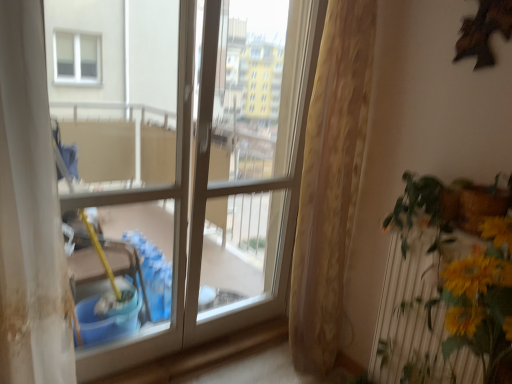
You are a GUI agent. You are given a task and a screenshot of the screen. Output one action in this format:
    pyautogui.click(x=<x>, y=<y>)
    Task: Click on the white glossy screen door at center
    Image resolution: width=512 pixels, height=384 pixels.
    Given the screenshot: What is the action you would take?
    pyautogui.click(x=246, y=162)

Is point (294, 56) closer to camera compared to point (453, 250)?

No.

Looking at their sizes, would you say white glossy screen door at center is wider or thinner than yellow artificial flowers at right?

Considering their sizes, white glossy screen door at center looks slimmer than yellow artificial flowers at right.

Where is `curtain lying on the right of clear glass window at center`? curtain lying on the right of clear glass window at center is located at coordinates (330, 182).

What's the angular difference between clear glass window at center and beige textured curtain at center's facing directions?

The angular difference between clear glass window at center and beige textured curtain at center is 0.256 degrees.

Considering the sizes of clear glass window at center and beige textured curtain at center in the image, is clear glass window at center wider or thinner than beige textured curtain at center?

In the image, clear glass window at center appears to be more narrow than beige textured curtain at center.

In the scene shown: In terms of height, does clear glass window at center look taller or shorter compared to beige textured curtain at center?

Clearly, clear glass window at center is shorter compared to beige textured curtain at center.

Does clear glass window at center turn towards white glossy screen door at center?

No, clear glass window at center does not turn towards white glossy screen door at center.

Find the location of `window directly beneath the white glossy screen door at center (from a real-world perspective)`. window directly beneath the white glossy screen door at center (from a real-world perspective) is located at coordinates (206, 171).

From a real-world perspective, does clear glass window at center stand above white glossy screen door at center?

No, from a real-world perspective, clear glass window at center is not over white glossy screen door at center

From a real-world perspective, which is physically above, yellow artificial flowers at right or beige textured curtain at center?

beige textured curtain at center is physically above.

Looking at this image, between yellow artificial flowers at right and beige textured curtain at center, which one has smaller size?

Smaller between the two is yellow artificial flowers at right.

Considering the points (410, 198) and (344, 161), which point is in front, point (410, 198) or point (344, 161)?

Point (410, 198)

From the image's perspective, which is above, yellow artificial flowers at right or white glossy screen door at center?

white glossy screen door at center, from the image's perspective.

Consider the image. Can you confirm if yellow artificial flowers at right is positioned to the right of white glossy screen door at center?

Yes, yellow artificial flowers at right is to the right of white glossy screen door at center.

Is the depth of yellow artificial flowers at right greater than that of white glossy screen door at center?

No, yellow artificial flowers at right is closer to the viewer.

Does beige textured curtain at center have a greater width compared to white glossy screen door at center?

Yes, beige textured curtain at center is wider than white glossy screen door at center.

What are the coordinates of `screen door on the left of beige textured curtain at center` in the screenshot? It's located at (246, 162).

Considering the relative positions of beige textured curtain at center and white glossy screen door at center in the image provided, is beige textured curtain at center to the left of white glossy screen door at center from the viewer's perspective?

In fact, beige textured curtain at center is to the right of white glossy screen door at center.

Can you confirm if beige textured curtain at center is positioned to the left of clear glass window at center?

Incorrect, beige textured curtain at center is not on the left side of clear glass window at center.

Is point (337, 238) in front of point (288, 55)?

Yes, it is in front of point (288, 55).

Between beige textured curtain at center and clear glass window at center, which one has smaller width?

clear glass window at center is thinner.

Find the location of a particular element. screen door above the yellow artificial flowers at right (from a real-world perspective) is located at coordinates (246, 162).

This screenshot has height=384, width=512. In order to click on window in front of the beige textured curtain at center in this screenshot , I will do `click(206, 171)`.

Estimate the real-world distances between objects in this image. Which object is further from yellow artificial flowers at right, beige textured curtain at center or clear glass window at center?

Based on the image, clear glass window at center appears to be further to yellow artificial flowers at right.

Estimate the real-world distances between objects in this image. Which object is closer to yellow artificial flowers at right, beige textured curtain at center or white glossy screen door at center?

Based on the image, beige textured curtain at center appears to be nearer to yellow artificial flowers at right.

Estimate the real-world distances between objects in this image. Which object is closer to yellow artificial flowers at right, white glossy screen door at center or beige textured curtain at center?

The object closer to yellow artificial flowers at right is beige textured curtain at center.

Based on their spatial positions, is yellow artificial flowers at right or clear glass window at center further from white glossy screen door at center?

The object further to white glossy screen door at center is yellow artificial flowers at right.

Based on their spatial positions, is clear glass window at center or yellow artificial flowers at right further from white glossy screen door at center?

yellow artificial flowers at right lies further to white glossy screen door at center than the other object.

When comparing their distances from beige textured curtain at center, does white glossy screen door at center or clear glass window at center seem further?

Result: white glossy screen door at center lies further to beige textured curtain at center than the other object.

When comparing their distances from yellow artificial flowers at right, does white glossy screen door at center or clear glass window at center seem closer?

Among the two, clear glass window at center is located nearer to yellow artificial flowers at right.

Based on their spatial positions, is clear glass window at center or beige textured curtain at center closer to yellow artificial flowers at right?

Among the two, beige textured curtain at center is located nearer to yellow artificial flowers at right.

At what (x,y) coordinates should I click in order to perform the action: click on screen door between clear glass window at center and beige textured curtain at center in the horizontal direction. Please return your answer as a coordinate pair (x, y). This screenshot has height=384, width=512. Looking at the image, I should click on tap(246, 162).

You are a GUI agent. You are given a task and a screenshot of the screen. Output one action in this format:
    pyautogui.click(x=<x>, y=<y>)
    Task: Click on the curtain between white glossy screen door at center and yellow artificial flowers at right
    This screenshot has height=384, width=512.
    Given the screenshot: What is the action you would take?
    pyautogui.click(x=330, y=182)

Where is `curtain between clear glass window at center and yellow artificial flowers at right from left to right`? The height and width of the screenshot is (384, 512). curtain between clear glass window at center and yellow artificial flowers at right from left to right is located at coordinates (330, 182).

You are a GUI agent. You are given a task and a screenshot of the screen. Output one action in this format:
    pyautogui.click(x=<x>, y=<y>)
    Task: Click on the screen door situated between clear glass window at center and yellow artificial flowers at right from left to right
    The image size is (512, 384).
    Given the screenshot: What is the action you would take?
    pyautogui.click(x=246, y=162)